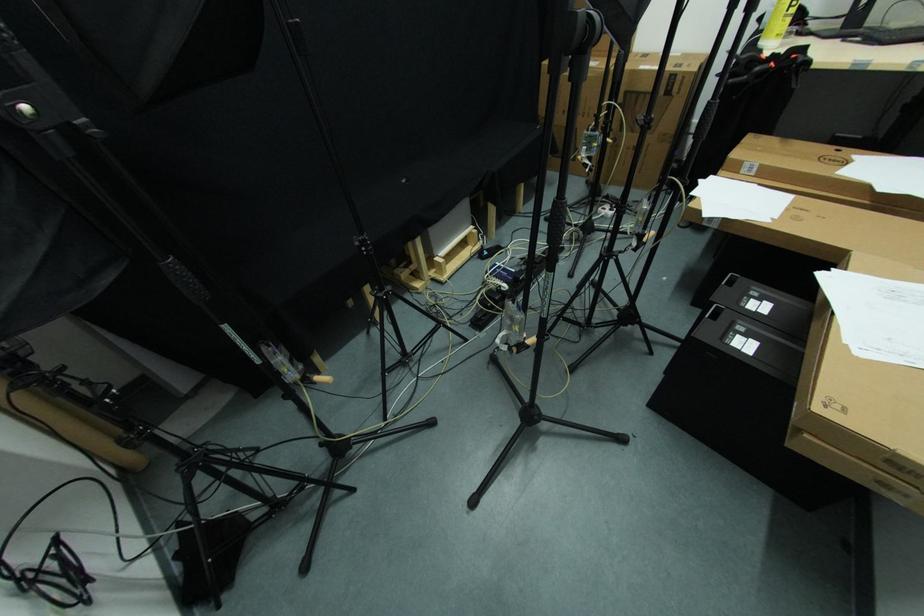
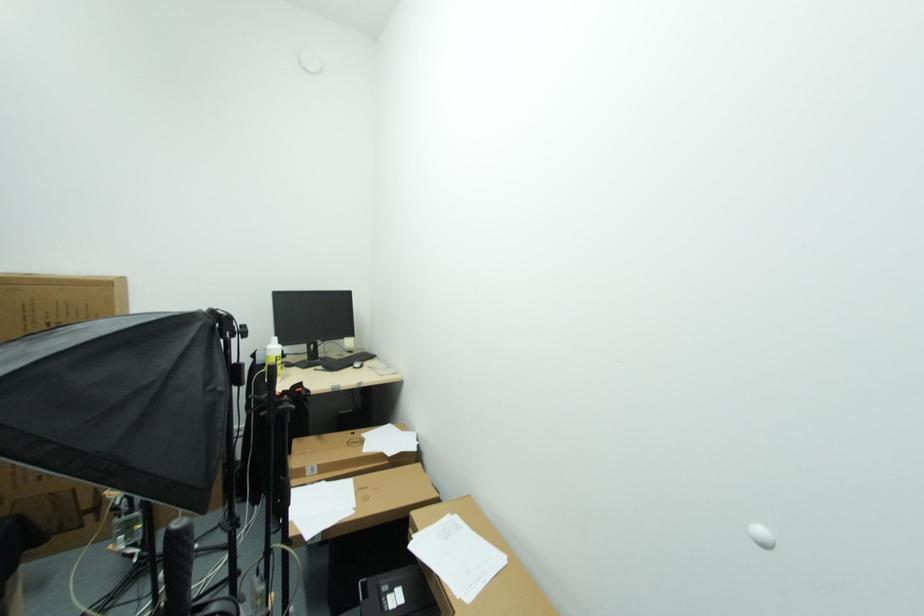
Find the pixel in the second image that matches (862,357) in the first image.

(470, 602)